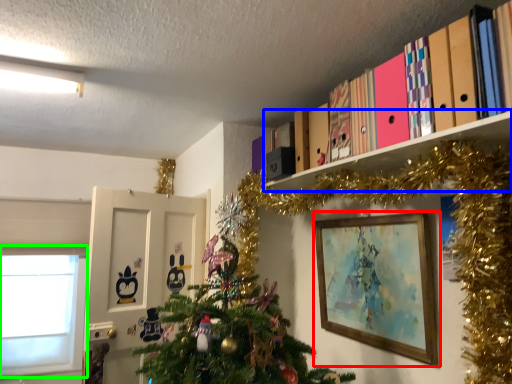
Question: Considering the real-world distances, which object is farthest from picture frame (highlighted by a red box)? shelf (highlighted by a blue box) or window (highlighted by a green box)?

Choices:
 (A) shelf
 (B) window

Answer: (B)